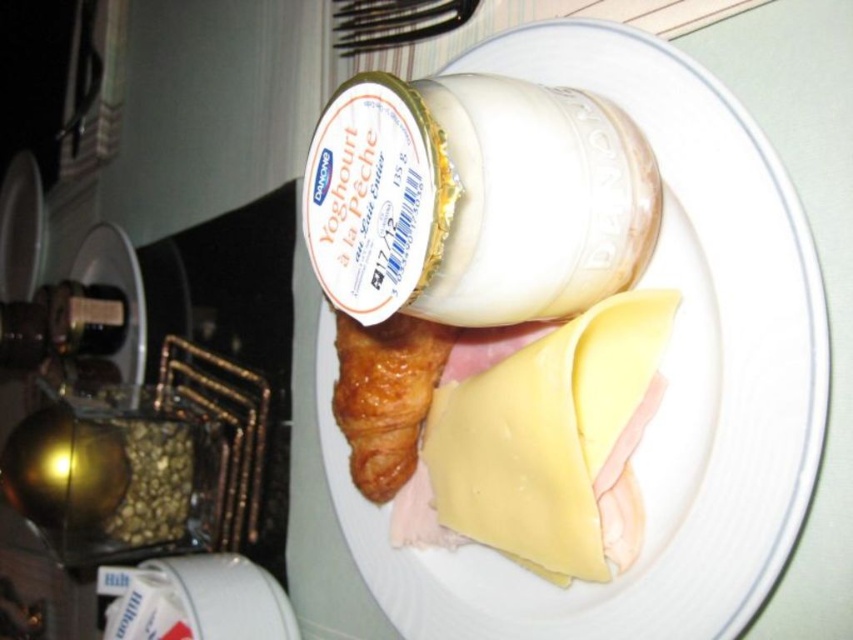
Question: Does yellow cheese at center appear under golden brown flaky croissant at center?

Choices:
 (A) yes
 (B) no

Answer: (A)

Question: Which object is closer to the camera taking this photo?

Choices:
 (A) golden brown flaky croissant at center
 (B) yellow cheese at center
 (C) white matte yogurt container at upper center

Answer: (C)

Question: Does white matte yogurt container at upper center appear on the right side of golden brown flaky croissant at center?

Choices:
 (A) no
 (B) yes

Answer: (B)

Question: Is white matte yogurt container at upper center bigger than golden brown flaky croissant at center?

Choices:
 (A) no
 (B) yes

Answer: (B)

Question: Which of the following is the closest to the observer?

Choices:
 (A) yellow cheese at center
 (B) golden brown flaky croissant at center
 (C) white matte yogurt container at upper center

Answer: (C)

Question: Estimate the real-world distances between objects in this image. Which object is closer to the yellow cheese at center?

Choices:
 (A) golden brown flaky croissant at center
 (B) white matte yogurt container at upper center

Answer: (B)